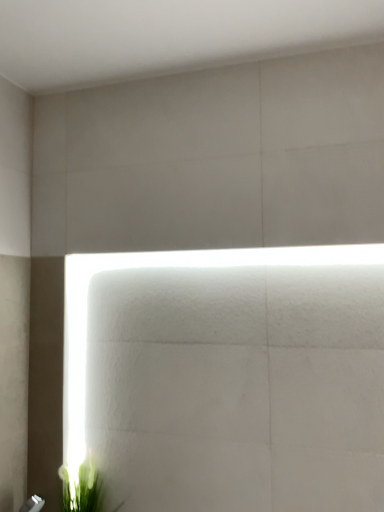
Measure the distance between green leafy plant at lower left and camera.

5.28 feet.

Locate an element on the screen. This screenshot has width=384, height=512. green leafy plant at lower left is located at coordinates (81, 487).

What do you see at coordinates (81, 487) in the screenshot? This screenshot has width=384, height=512. I see `green leafy plant at lower left` at bounding box center [81, 487].

Identify the location of green leafy plant at lower left. The image size is (384, 512). (81, 487).